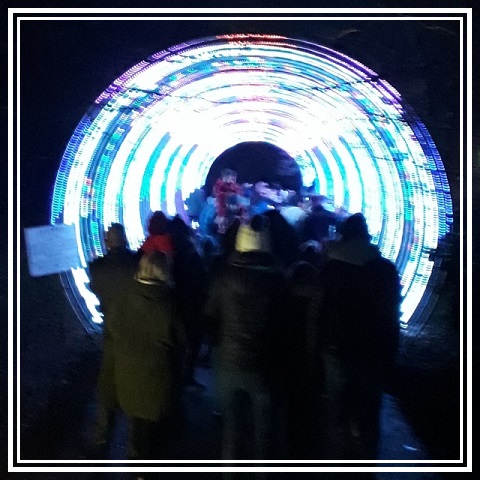
Image resolution: width=480 pixels, height=480 pixels. What are the coordinates of `bright light` in the screenshot? It's located at (196, 121), (318, 124).